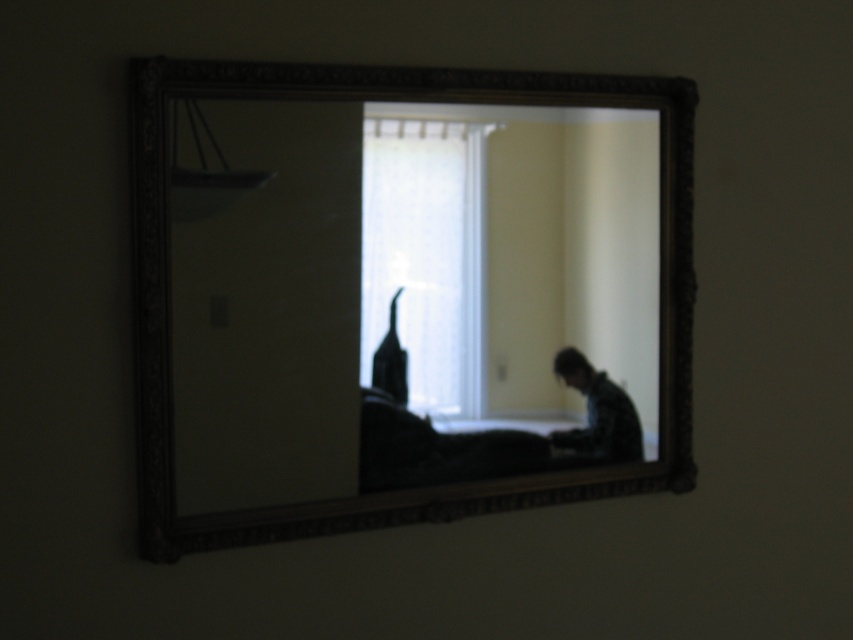
Question: Can you confirm if wooden frame mirror at center is bigger than white sheer curtain at center?

Choices:
 (A) yes
 (B) no

Answer: (A)

Question: Which object appears closest to the camera in this image?

Choices:
 (A) white sheer curtain at center
 (B) wooden frame mirror at center

Answer: (B)

Question: Can you confirm if wooden frame mirror at center is thinner than white sheer curtain at center?

Choices:
 (A) no
 (B) yes

Answer: (A)

Question: Is wooden frame mirror at center below white sheer curtain at center?

Choices:
 (A) no
 (B) yes

Answer: (B)